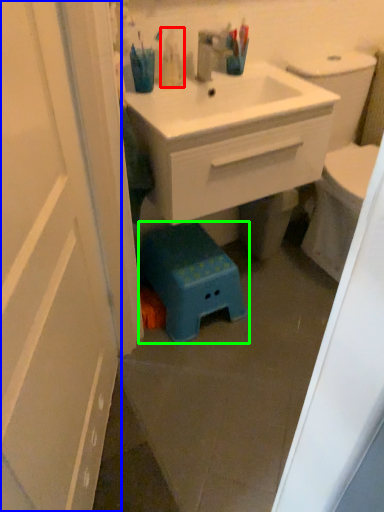
Question: Which is farther away from toiletry (highlighted by a red box)? door (highlighted by a blue box) or step stool (highlighted by a green box)?

Choices:
 (A) door
 (B) step stool

Answer: (A)